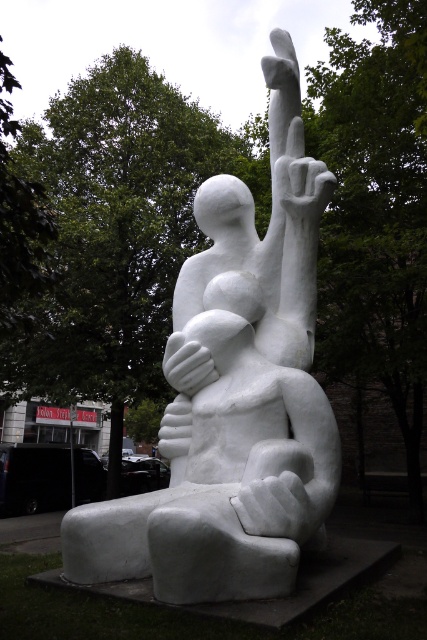
From the picture: You are an art student analyzing the sculpture. You notice the white stone sculpture at center and the white matte hand at center. Which object is located to the right of the other?

The white stone sculpture at center is positioned on the right side of white matte hand at center.

You are standing in the park and see the white stone sculpture at center. Can you tell me where the point at coordinates (233,404) is located?

The point at coordinates (233,404) is located on the white stone sculpture at center.